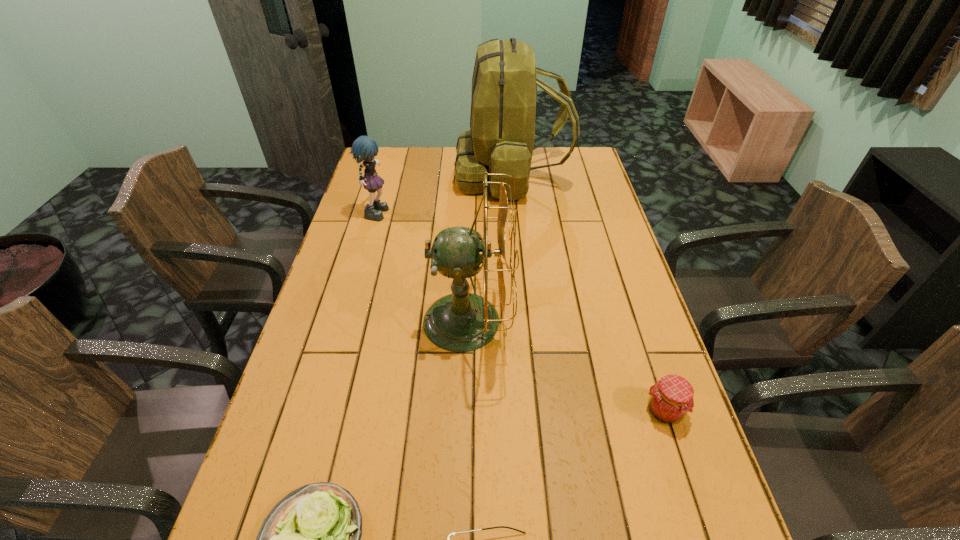
Image resolution: width=960 pixels, height=540 pixels. Find the location of `free space located on the front-facing side of the rag doll`. free space located on the front-facing side of the rag doll is located at coordinates (405, 211).

Locate an element on the screen. blank area located on the back of the third nearest object is located at coordinates (636, 325).

At what (x,y) coordinates should I click in order to perform the action: click on object situated at the far edge. Please return your answer as a coordinate pair (x, y). Looking at the image, I should click on (501, 138).

You are a GUI agent. You are given a task and a screenshot of the screen. Output one action in this format:
    pyautogui.click(x=<x>, y=<y>)
    Task: Click on the object at the left edge
    
    Given the screenshot: What is the action you would take?
    pyautogui.click(x=364, y=148)

Find the location of a particular element. backpack at the right edge is located at coordinates pos(501,138).

What are the coordinates of `jam at the right edge` in the screenshot? It's located at (671, 398).

Where is `object that is at the far right corner`? The height and width of the screenshot is (540, 960). object that is at the far right corner is located at coordinates (501, 138).

Image resolution: width=960 pixels, height=540 pixels. I want to click on blank space at the far edge of the desktop, so click(416, 151).

Identify the location of vacant area at the left edge. Image resolution: width=960 pixels, height=540 pixels. (387, 181).

Find the location of `vacant space at the right edge of the desktop`. vacant space at the right edge of the desktop is located at coordinates (620, 247).